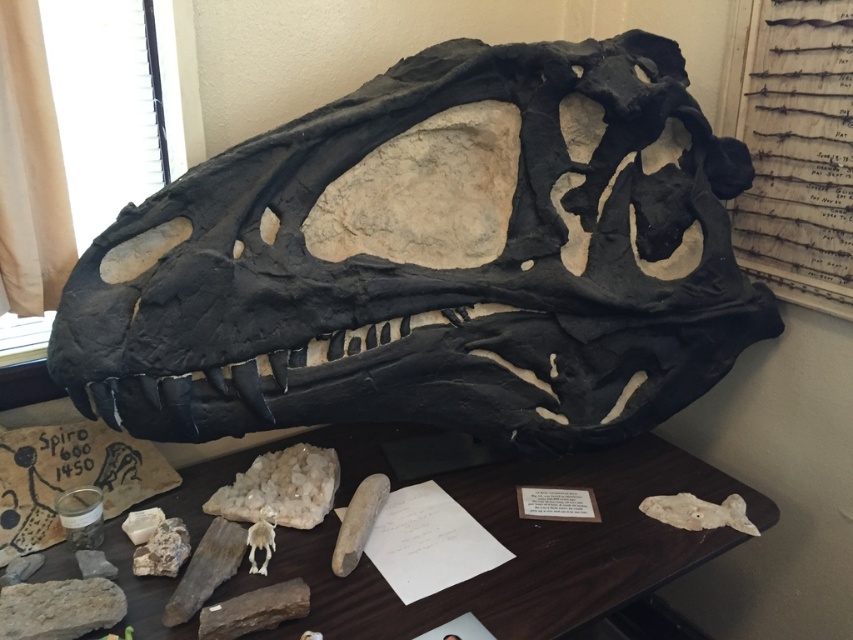
Question: Which object is closer to the camera taking this photo?

Choices:
 (A) white bone at center
 (B) matte black skull at center

Answer: (B)

Question: Which of the following is the closest to the observer?

Choices:
 (A) smooth wooden table at center
 (B) matte black skull at center

Answer: (A)

Question: Is matte black skull at center smaller than smooth wooden table at center?

Choices:
 (A) yes
 (B) no

Answer: (B)

Question: Which of the following is the farthest from the observer?

Choices:
 (A) smooth wooden table at center
 (B) white bone at center
 (C) matte black skull at center

Answer: (B)

Question: Does matte black skull at center appear over smooth wooden table at center?

Choices:
 (A) no
 (B) yes

Answer: (B)

Question: Is matte black skull at center closer to camera compared to white bone at center?

Choices:
 (A) yes
 (B) no

Answer: (A)